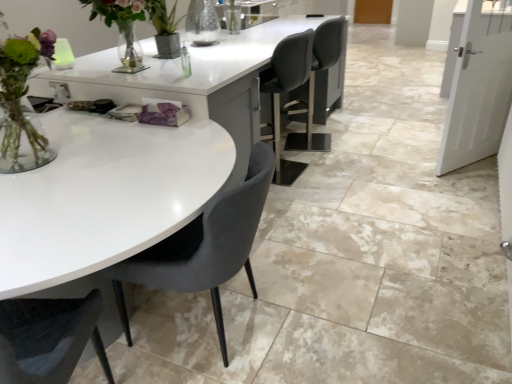
Find the location of `vacant region to the right of velvet grey chair at center`. vacant region to the right of velvet grey chair at center is located at coordinates (327, 312).